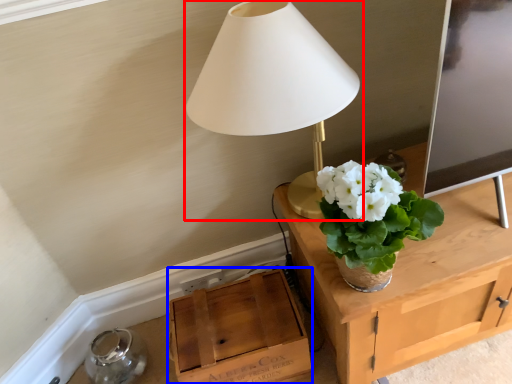
Question: Which of the following is the farthest to the observer, lamp (highlighted by a red box) or cardboard box (highlighted by a blue box)?

Choices:
 (A) lamp
 (B) cardboard box

Answer: (B)